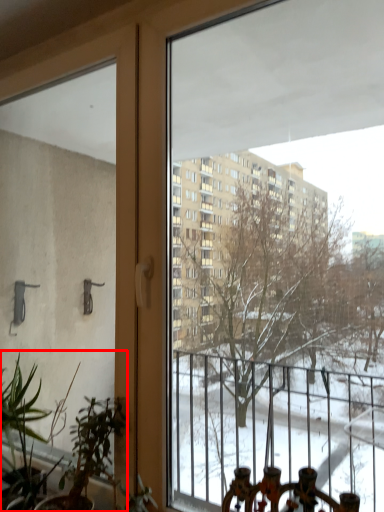
Question: From the image's perspective, where is houseplant (annotated by the red box) located in relation to plant in the image?

Choices:
 (A) below
 (B) above

Answer: (A)